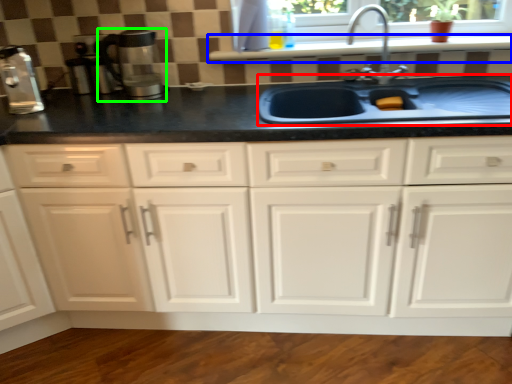
Question: Estimate the real-world distances between objects in this image. Which object is farther from sink (highlighted by a red box), window sill (highlighted by a blue box) or coffee machine (highlighted by a green box)?

Choices:
 (A) window sill
 (B) coffee machine

Answer: (B)